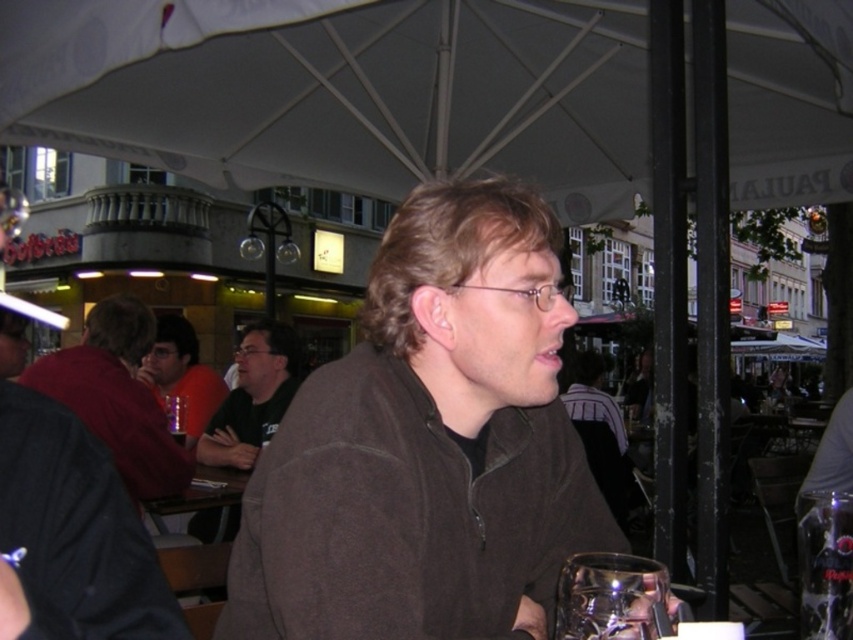
Question: Estimate the real-world distances between objects in this image. Which object is farther from the clear plastic glass at lower right?

Choices:
 (A) brown fleece jacket at center
 (B) dark red shirt at left
 (C) matte black shirt at center

Answer: (C)

Question: Which object is positioned farthest from the dark red shirt at left?

Choices:
 (A) matte black shirt at center
 (B) dark brown leather jacket at upper left
 (C) dark green shirt at center
 (D) brown fleece jacket at center

Answer: (B)

Question: Is brown fleece jacket at center positioned before dark red shirt at left?

Choices:
 (A) no
 (B) yes

Answer: (B)

Question: Can you confirm if dark brown leather jacket at upper left is smaller than matte black shirt at center?

Choices:
 (A) yes
 (B) no

Answer: (A)

Question: In this image, where is dark brown leather jacket at upper left located relative to dark green shirt at center?

Choices:
 (A) below
 (B) above

Answer: (B)

Question: Which of these objects is positioned closest to the transparent glass at lower right?

Choices:
 (A) dark red shirt at left
 (B) matte black shirt at center
 (C) brown fleece jacket at center
 (D) clear plastic glass at lower right

Answer: (C)